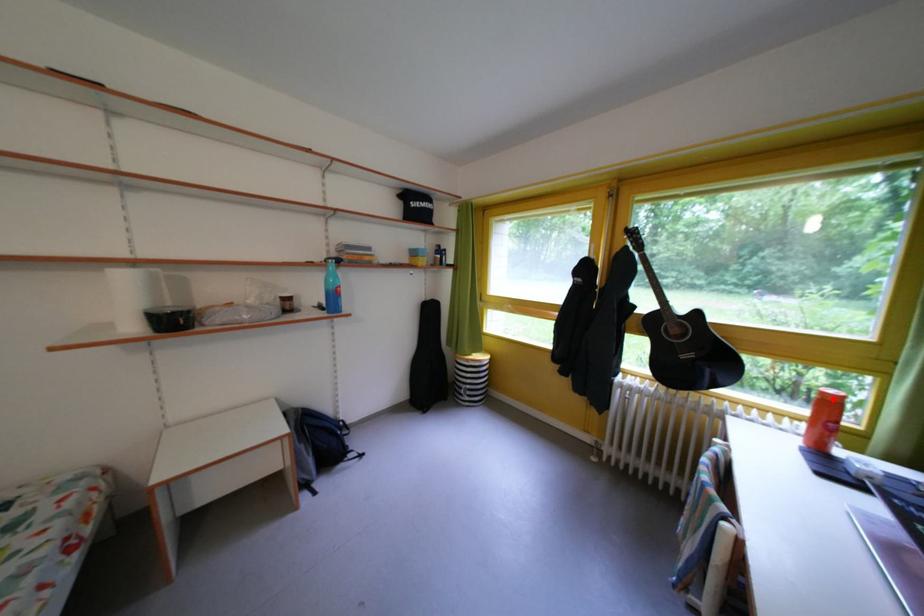
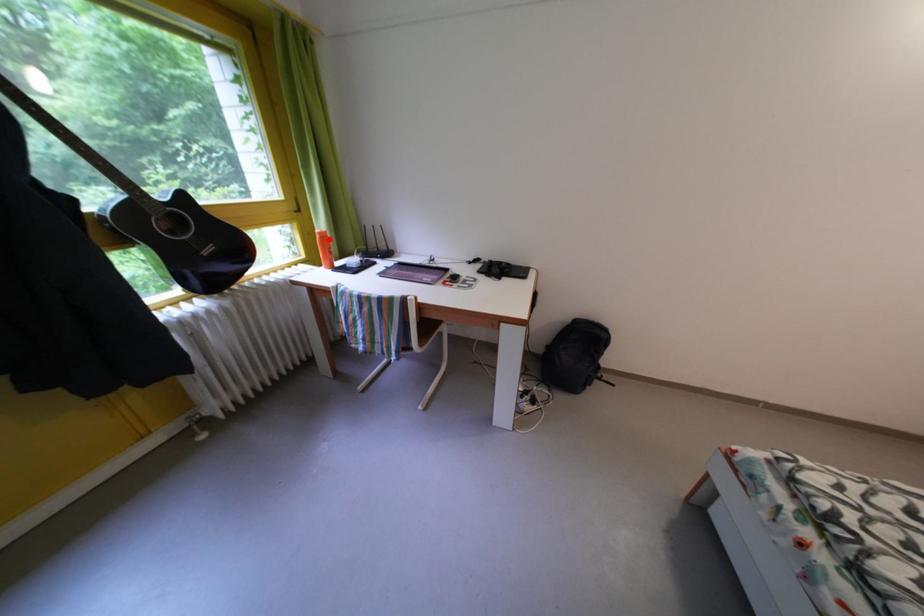
I am providing you with two images of the same scene from different viewpoints. A red point is marked on the first image and another point is marked on the second image. Are the points marked in image1 and image2 representing the same 3D position?

Yes